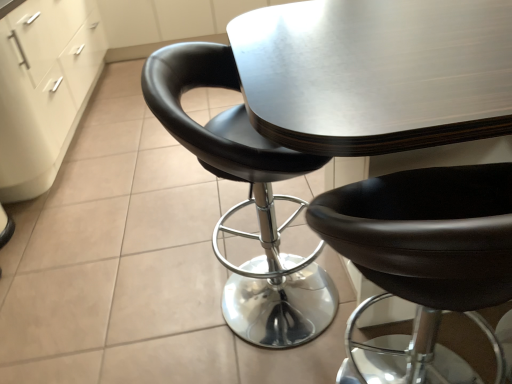
Question: Does black leather chair at center, the first chair in the right-to-left sequence, contain black leather chair at center, which is the 1th chair from left to right?

Choices:
 (A) no
 (B) yes

Answer: (A)

Question: Is black leather chair at center, the first chair in the right-to-left sequence, facing away from black leather chair at center, which is the 1th chair from left to right?

Choices:
 (A) no
 (B) yes

Answer: (A)

Question: From the image's perspective, would you say black leather chair at center, the second chair viewed from the left, is shown under black leather chair at center, which is the 1th chair from left to right?

Choices:
 (A) no
 (B) yes

Answer: (B)

Question: Considering the relative sizes of black leather chair at center, the second chair viewed from the left, and black leather chair at center, which is the 2th chair from right to left, in the image provided, is black leather chair at center, the second chair viewed from the left, taller than black leather chair at center, which is the 2th chair from right to left,?

Choices:
 (A) no
 (B) yes

Answer: (A)

Question: Would you say black leather chair at center, the first chair in the right-to-left sequence, is outside black leather chair at center, which is the 2th chair from right to left?

Choices:
 (A) yes
 (B) no

Answer: (A)

Question: Does black leather chair at center, the first chair in the right-to-left sequence, appear on the right side of black leather chair at center, which is the 2th chair from right to left?

Choices:
 (A) no
 (B) yes

Answer: (B)

Question: Is white matte file cabinet at lower left at the left side of black leather chair at center, the first chair in the right-to-left sequence?

Choices:
 (A) yes
 (B) no

Answer: (A)

Question: Would you say white matte file cabinet at lower left contains black leather chair at center, the first chair in the right-to-left sequence?

Choices:
 (A) no
 (B) yes

Answer: (A)

Question: From a real-world perspective, is white matte file cabinet at lower left positioned over black leather chair at center, the second chair viewed from the left, based on gravity?

Choices:
 (A) yes
 (B) no

Answer: (A)

Question: Is white matte file cabinet at lower left closer to the viewer compared to black leather chair at center, the first chair in the right-to-left sequence?

Choices:
 (A) no
 (B) yes

Answer: (A)

Question: Does white matte file cabinet at lower left have a lesser width compared to black leather chair at center, the second chair viewed from the left?

Choices:
 (A) no
 (B) yes

Answer: (A)

Question: Is white matte file cabinet at lower left oriented away from black leather chair at center, the second chair viewed from the left?

Choices:
 (A) yes
 (B) no

Answer: (B)

Question: Could you tell me if black leather chair at center, which is the 1th chair from left to right, is turned towards white matte file cabinet at lower left?

Choices:
 (A) yes
 (B) no

Answer: (B)